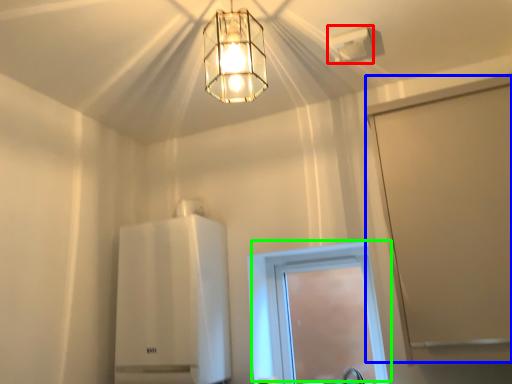
Question: Considering the real-world distances, which object is farthest from lamp (highlighted by a red box)? screen door (highlighted by a blue box) or window (highlighted by a green box)?

Choices:
 (A) screen door
 (B) window

Answer: (B)